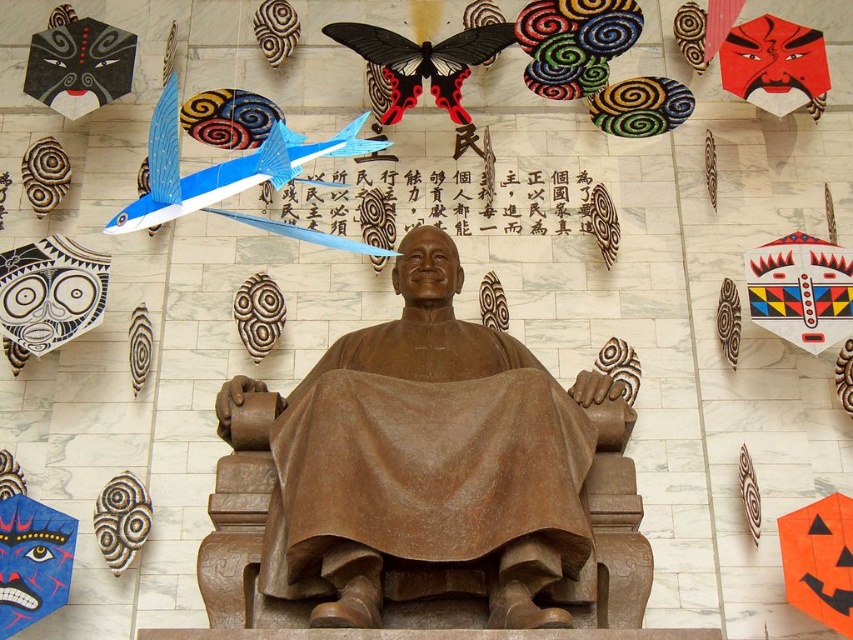
This screenshot has height=640, width=853. I want to click on bronze statue at center, so click(x=432, y=465).

Does bronze statue at center appear on the left side of spiral-patterned wood at lower left?

Incorrect, bronze statue at center is not on the left side of spiral-patterned wood at lower left.

Where is `bronze statue at center`? The height and width of the screenshot is (640, 853). bronze statue at center is located at coordinates (432, 465).

Can you confirm if red matte mask at upper right is wider than spiral-patterned wood at lower left?

Correct, the width of red matte mask at upper right exceeds that of spiral-patterned wood at lower left.

Who is more forward, (822, 100) or (103, 508)?

Point (103, 508) is more forward.

The image size is (853, 640). In order to click on red matte mask at upper right in this screenshot , I will do `click(775, 65)`.

Image resolution: width=853 pixels, height=640 pixels. In order to click on red matte mask at upper right in this screenshot , I will do `click(775, 65)`.

Who is taller, bronze statue at center or red matte mask at upper right?

With more height is bronze statue at center.

Which is in front, point (480, 410) or point (758, 64)?

Positioned in front is point (480, 410).

This screenshot has height=640, width=853. Identify the location of bronze statue at center. coord(432,465).